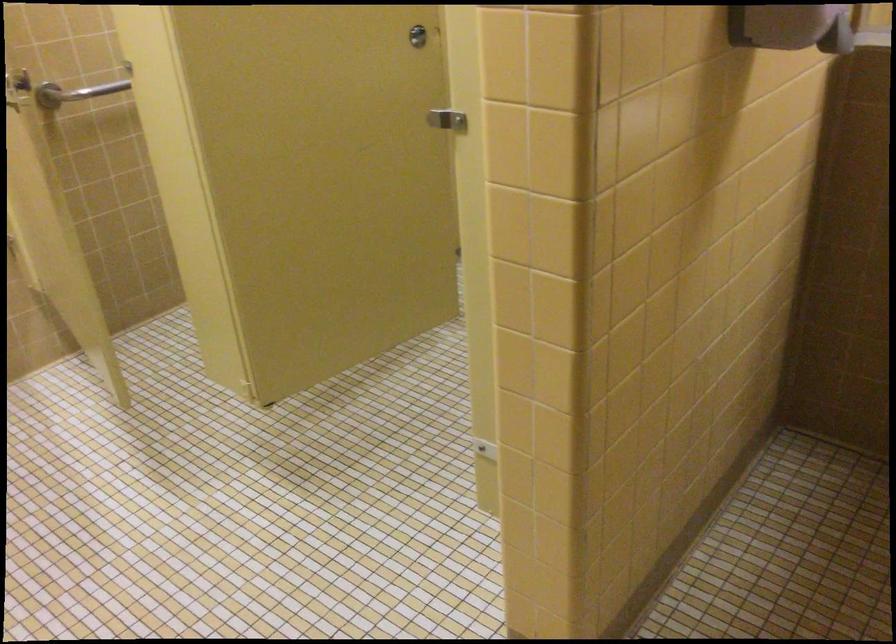
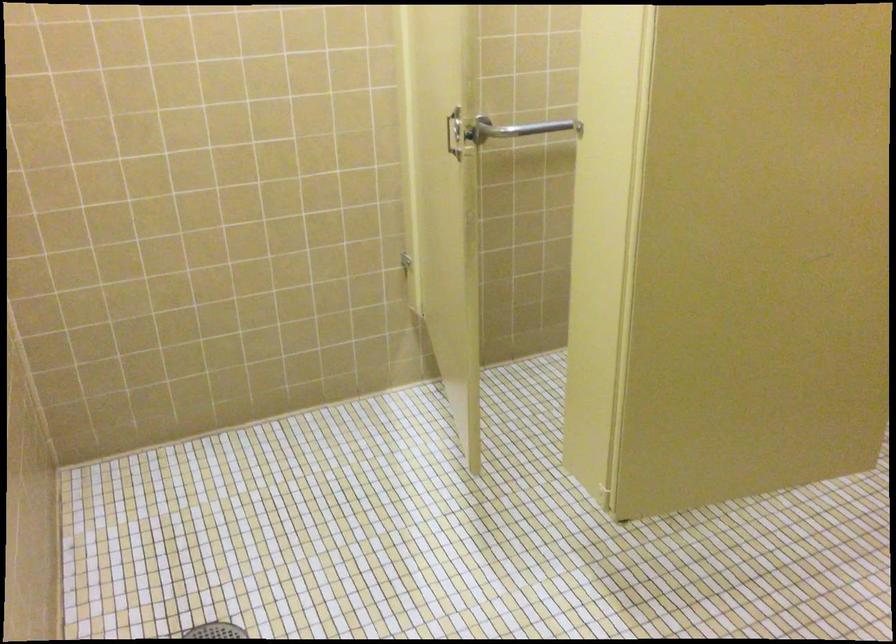
What movement of the cameraman would produce the second image?

The movement direction of the cameraman is left, forward.